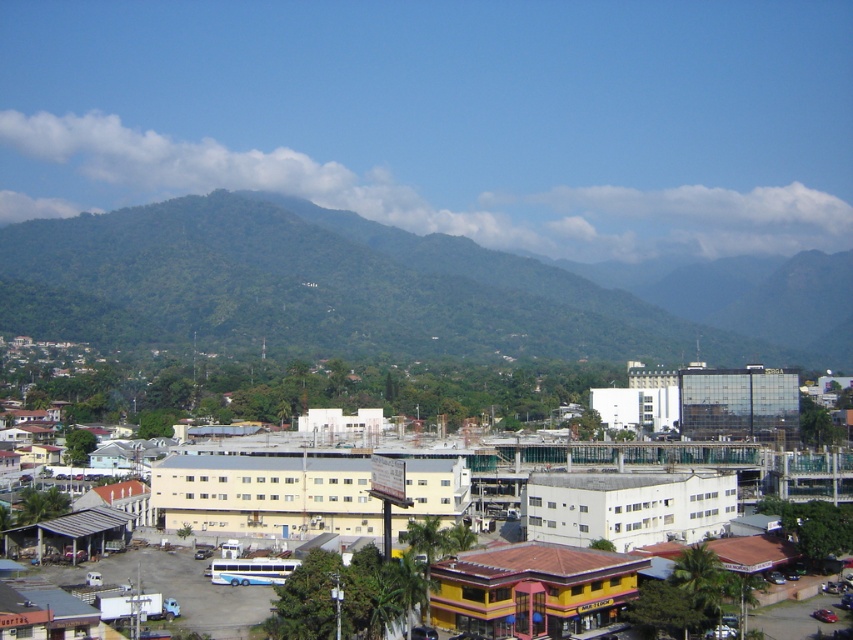
I want to click on green leafy mountain at center, so click(399, 289).

Is point (329, 243) less distant than point (463, 369)?

That is False.

Between point (323, 349) and point (383, 429), which one is positioned in front?

Positioned in front is point (383, 429).

Identify the location of green leafy mountain at center. This screenshot has height=640, width=853. coord(399,289).